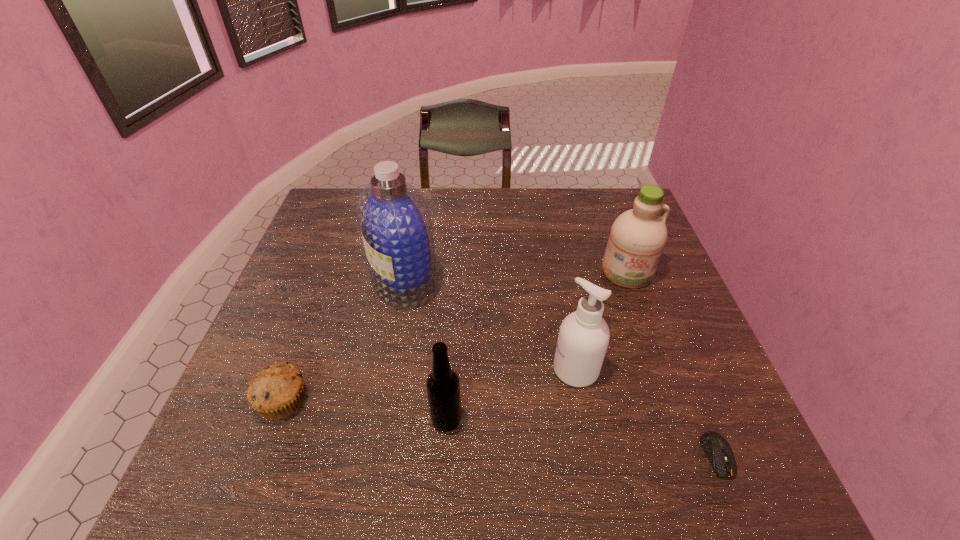
Locate an element on the screen. The width and height of the screenshot is (960, 540). vacant space located 0.110m on the front label of the rightmost cleansing agent is located at coordinates (644, 321).

Where is `vacant space positioned on the front label of the second cleansing agent from left to right`? vacant space positioned on the front label of the second cleansing agent from left to right is located at coordinates (436, 369).

Where is `free space located on the front label of the second cleansing agent from left to right`? The image size is (960, 540). free space located on the front label of the second cleansing agent from left to right is located at coordinates (481, 369).

Find the location of `free location located on the front label of the second cleansing agent from left to right`. free location located on the front label of the second cleansing agent from left to right is located at coordinates (436, 369).

The width and height of the screenshot is (960, 540). In order to click on vacant space located on the left of the third object from left to right in this screenshot , I will do `click(372, 419)`.

Image resolution: width=960 pixels, height=540 pixels. Identify the location of free space located 0.120m on the back of the second shortest object. (307, 335).

Where is `object present at the near edge`? This screenshot has width=960, height=540. object present at the near edge is located at coordinates (716, 447).

Find the location of a particular element. The image size is (960, 540). object positioned at the left edge is located at coordinates (277, 391).

Image resolution: width=960 pixels, height=540 pixels. I want to click on cleansing agent located in the right edge section of the desktop, so click(638, 236).

Where is `computer equipment at the right edge`? This screenshot has height=540, width=960. computer equipment at the right edge is located at coordinates (716, 447).